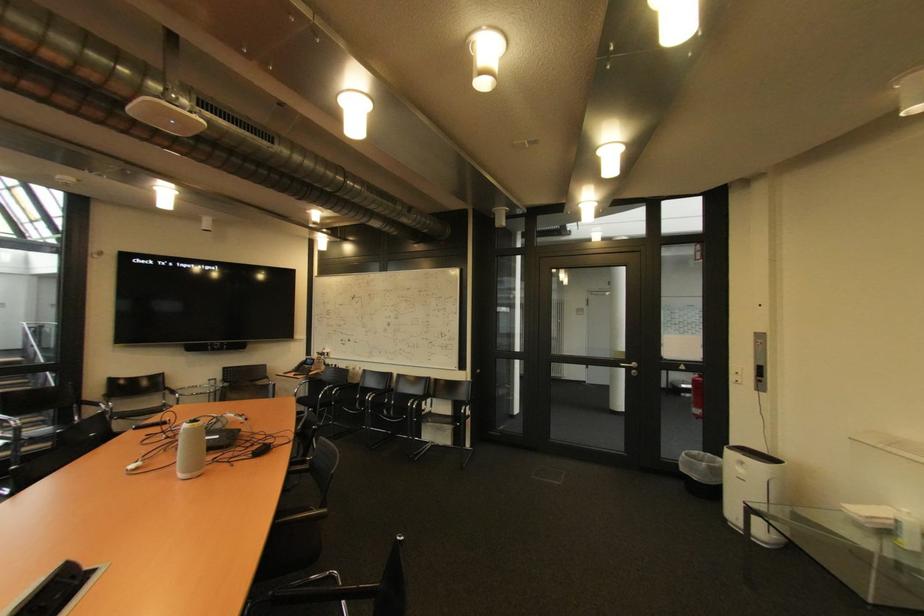
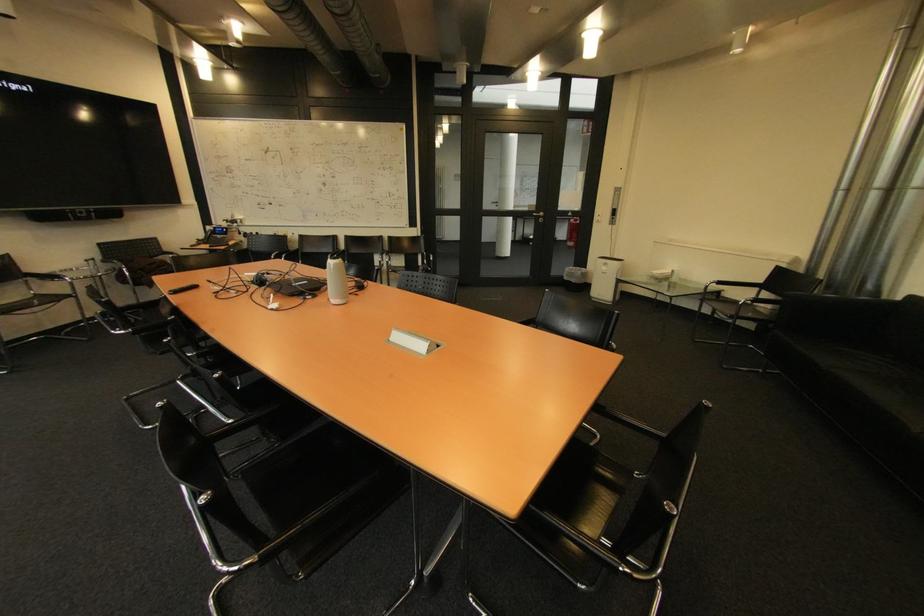
Where in the second image is the point corresponding to point (630, 359) from the first image?

(542, 209)